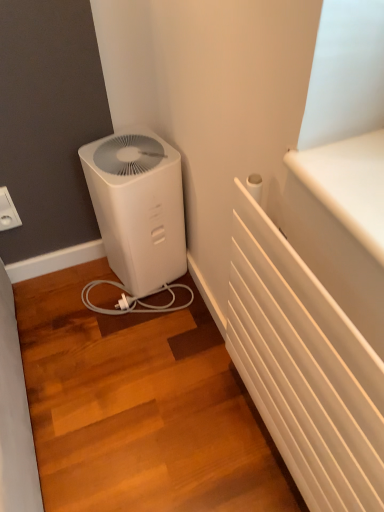
Where is `space that is in front of white plastic air purifier at lower left`? space that is in front of white plastic air purifier at lower left is located at coordinates (146, 323).